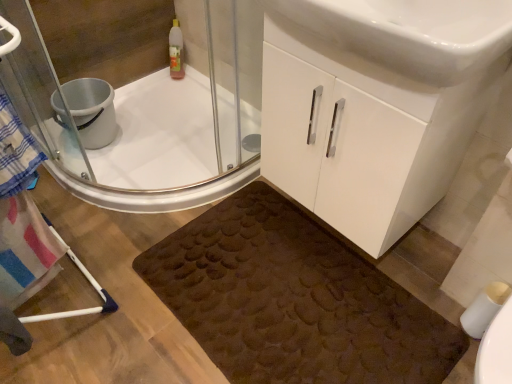
Where is `vacant space underneath clear glass shower door at upper left (from a real-world perspective)`? This screenshot has height=384, width=512. vacant space underneath clear glass shower door at upper left (from a real-world perspective) is located at coordinates (209, 177).